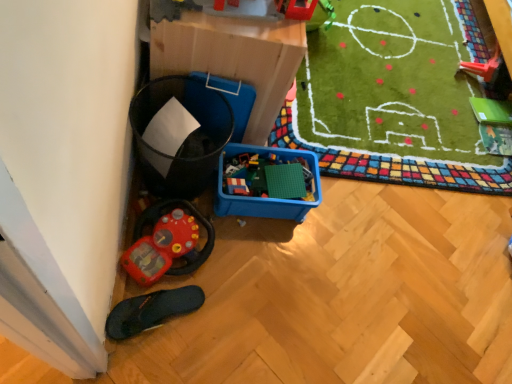
This screenshot has width=512, height=384. I want to click on black rubber slipper at lower left, so click(x=151, y=310).

In order to face rubberized plastic toy at upper center, the second toy from the left, should I rotate leftwards or rightwards?

Turn right approximately 6.769 degrees to face it.

Image resolution: width=512 pixels, height=384 pixels. Identify the location of rubberized plastic toy at upper center, the second toy from the left. (296, 9).

What do you see at coordinates (484, 66) in the screenshot? Image resolution: width=512 pixels, height=384 pixels. I see `rubberized plastic toy at upper right, acting as the third toy starting from the bottom` at bounding box center [484, 66].

Where is `black rubber slipper at lower left`? black rubber slipper at lower left is located at coordinates (151, 310).

Does rubberized red toy car at lower left, which appears as the first toy when ordered from the bottom, appear on the right side of black rubber slipper at lower left?

No, rubberized red toy car at lower left, which appears as the first toy when ordered from the bottom, is not to the right of black rubber slipper at lower left.

Which of these two, rubberized red toy car at lower left, which appears as the first toy when ordered from the bottom, or black rubber slipper at lower left, is thinner?

With smaller width is rubberized red toy car at lower left, which appears as the first toy when ordered from the bottom.

Could you tell me if rubberized red toy car at lower left, the 3th toy when ordered from top to bottom, is facing black rubber slipper at lower left?

No.

The image size is (512, 384). Find the location of `footwear that is below the rubberized red toy car at lower left, arranged as the third toy when viewed from the right (from the image's perspective)`. footwear that is below the rubberized red toy car at lower left, arranged as the third toy when viewed from the right (from the image's perspective) is located at coordinates (151, 310).

From a real-world perspective, does rubberized plastic toy at upper right, the third toy when ordered from front to back, sit lower than rubberized red toy car at lower left, the first toy from the left?

No, from a real-world perspective, rubberized plastic toy at upper right, the third toy when ordered from front to back, is not beneath rubberized red toy car at lower left, the first toy from the left.

Is rubberized plastic toy at upper right, positioned as the third toy in left-to-right order, not close to rubberized red toy car at lower left, which appears as the first toy when ordered from the bottom?

Indeed, rubberized plastic toy at upper right, positioned as the third toy in left-to-right order, is not near rubberized red toy car at lower left, which appears as the first toy when ordered from the bottom.

Is rubberized plastic toy at upper right, the third toy when ordered from front to back, oriented away from rubberized red toy car at lower left, arranged as the third toy when viewed from the right?

rubberized plastic toy at upper right, the third toy when ordered from front to back, is not turned away from rubberized red toy car at lower left, arranged as the third toy when viewed from the right.

In terms of width, does rubberized plastic toy at upper right, the third toy when ordered from front to back, look wider or thinner when compared to rubberized red toy car at lower left, which is counted as the 2th toy, starting from the back?

Considering their sizes, rubberized plastic toy at upper right, the third toy when ordered from front to back, looks slimmer than rubberized red toy car at lower left, which is counted as the 2th toy, starting from the back.

Is black rubber slipper at lower left spatially inside blue plastic storage box at lower left, or outside of it?

black rubber slipper at lower left is located beyond the bounds of blue plastic storage box at lower left.

Is black rubber slipper at lower left positioned with its back to blue plastic storage box at lower left?

No, black rubber slipper at lower left is not facing away from blue plastic storage box at lower left.

From a real-world perspective, is black rubber slipper at lower left beneath blue plastic storage box at lower left?

Yes, from a real-world perspective, black rubber slipper at lower left is beneath blue plastic storage box at lower left.

Considering the relative positions of black rubber slipper at lower left and blue plastic storage box at lower left in the image provided, is black rubber slipper at lower left in front of blue plastic storage box at lower left?

That is False.

Does point (275, 2) appear closer or farther from the camera than point (169, 302)?

Point (275, 2).

Does rubberized plastic toy at upper center, the second toy from the left, have a lesser width compared to black rubber slipper at lower left?

Indeed, rubberized plastic toy at upper center, the second toy from the left, has a lesser width compared to black rubber slipper at lower left.

Who is taller, rubberized plastic toy at upper center, the second toy from the left, or black rubber slipper at lower left?

rubberized plastic toy at upper center, the second toy from the left.

Measure the distance between rubberized plastic toy at upper center, placed as the second toy when sorted from bottom to top, and black rubber slipper at lower left.

1.02 meters.

Based on the photo, how distant is blue plastic storage box at lower left from rubberized plastic toy at upper center, placed as the second toy when sorted from bottom to top?

blue plastic storage box at lower left and rubberized plastic toy at upper center, placed as the second toy when sorted from bottom to top, are 11.36 inches apart.

Is rubberized plastic toy at upper center, which is counted as the second toy, starting from the right, completely or partially inside blue plastic storage box at lower left?

No, rubberized plastic toy at upper center, which is counted as the second toy, starting from the right, is not a part of blue plastic storage box at lower left.

Is point (165, 64) closer or farther from the camera than point (281, 11)?

Point (165, 64) is closer to the camera than point (281, 11).

Is blue plastic storage box at lower left far away from rubberized plastic toy at upper center, placed as the second toy when sorted from bottom to top?

blue plastic storage box at lower left is near rubberized plastic toy at upper center, placed as the second toy when sorted from bottom to top, not far away.

Are blue plastic storage box at lower left and rubberized plastic toy at upper right, acting as the third toy starting from the bottom, far apart?

Yes, blue plastic storage box at lower left and rubberized plastic toy at upper right, acting as the third toy starting from the bottom, are located far from each other.

Considering the positions of objects blue plastic storage box at lower left and rubberized plastic toy at upper right, the 1th toy positioned from the right, in the image provided, who is behind, blue plastic storage box at lower left or rubberized plastic toy at upper right, the 1th toy positioned from the right,?

rubberized plastic toy at upper right, the 1th toy positioned from the right, is more distant.

Looking at this image, could you tell me if blue plastic storage box at lower left is turned towards rubberized plastic toy at upper right, positioned as the third toy in left-to-right order?

Yes, blue plastic storage box at lower left is oriented towards rubberized plastic toy at upper right, positioned as the third toy in left-to-right order.

Is rubberized plastic toy at upper right, acting as the third toy starting from the bottom, further to camera compared to blue plastic storage box at lower left?

Yes, rubberized plastic toy at upper right, acting as the third toy starting from the bottom, is further from the viewer.

Measure the distance from rubberized plastic toy at upper right, positioned as the third toy in left-to-right order, to blue plastic storage box at lower left.

rubberized plastic toy at upper right, positioned as the third toy in left-to-right order, is 4.53 feet from blue plastic storage box at lower left.

In the scene shown: Considering the sizes of objects rubberized plastic toy at upper right, arranged as the 1th toy when viewed from the back, and blue plastic storage box at lower left in the image provided, who is taller, rubberized plastic toy at upper right, arranged as the 1th toy when viewed from the back, or blue plastic storage box at lower left?

blue plastic storage box at lower left.

Is rubberized plastic toy at upper right, positioned as the third toy in left-to-right order, facing away from blue plastic storage box at lower left?

No, rubberized plastic toy at upper right, positioned as the third toy in left-to-right order, is not facing away from blue plastic storage box at lower left.

What are the coordinates of `footwear below the rubberized red toy car at lower left, the 3th toy when ordered from top to bottom (from the image's perspective)` in the screenshot? It's located at (151, 310).

You are a GUI agent. You are given a task and a screenshot of the screen. Output one action in this format:
    pyautogui.click(x=<x>, y=<y>)
    Task: Click on the 1st toy in front of the rubberized plastic toy at upper right, arranged as the 1th toy when viewed from the back
    
    Given the screenshot: What is the action you would take?
    pyautogui.click(x=167, y=241)

Which object lies further to the anchor point rubberized plastic toy at upper center, which is the 2th toy in top-to-bottom order, black rubber slipper at lower left or rubberized red toy car at lower left, arranged as the third toy when viewed from the right?

black rubber slipper at lower left is positioned further to the anchor rubberized plastic toy at upper center, which is the 2th toy in top-to-bottom order.

In the scene shown: Based on their spatial positions, is blue plastic storage box at lower left or rubberized red toy car at lower left, the first toy from the left, further from black rubber slipper at lower left?

Based on the image, blue plastic storage box at lower left appears to be further to black rubber slipper at lower left.

From the image, which object appears to be nearer to blue plastic storage box at lower left, rubberized red toy car at lower left, which is counted as the 2th toy, starting from the back, or black rubber slipper at lower left?

The object closer to blue plastic storage box at lower left is rubberized red toy car at lower left, which is counted as the 2th toy, starting from the back.

Considering their positions, is rubberized plastic toy at upper right, acting as the third toy starting from the bottom, positioned closer to rubberized red toy car at lower left, the first toy from the left, than rubberized plastic toy at upper center, placed as the second toy when sorted from bottom to top?

rubberized plastic toy at upper center, placed as the second toy when sorted from bottom to top, is positioned closer to the anchor rubberized red toy car at lower left, the first toy from the left.

Estimate the real-world distances between objects in this image. Which object is further from blue plastic storage box at lower left, black rubber slipper at lower left or rubberized red toy car at lower left, which appears as the first toy when ordered from the bottom?

black rubber slipper at lower left lies further to blue plastic storage box at lower left than the other object.

When comparing their distances from rubberized red toy car at lower left, the first toy from the left, does blue plastic storage box at lower left or rubberized plastic toy at upper center, the second toy from the left, seem further?

Based on the image, rubberized plastic toy at upper center, the second toy from the left, appears to be further to rubberized red toy car at lower left, the first toy from the left.

Considering their positions, is black rubber slipper at lower left positioned further to rubberized red toy car at lower left, the first toy from the left, than rubberized plastic toy at upper right, acting as the 1th toy starting from the top?

rubberized plastic toy at upper right, acting as the 1th toy starting from the top, is positioned further to the anchor rubberized red toy car at lower left, the first toy from the left.

Looking at the image, which one is located closer to blue plastic storage box at lower left, black rubber slipper at lower left or rubberized plastic toy at upper right, the 1th toy positioned from the right?

black rubber slipper at lower left lies closer to blue plastic storage box at lower left than the other object.

Where is `toy situated between blue plastic storage box at lower left and rubberized plastic toy at upper right, the 1th toy positioned from the right, from left to right`? This screenshot has width=512, height=384. toy situated between blue plastic storage box at lower left and rubberized plastic toy at upper right, the 1th toy positioned from the right, from left to right is located at coordinates (296, 9).

The image size is (512, 384). I want to click on footwear between rubberized red toy car at lower left, which appears as the first toy when ordered from the bottom, and rubberized plastic toy at upper right, acting as the 1th toy starting from the top, so click(x=151, y=310).

Find the location of a particular element. This screenshot has width=512, height=384. toy between rubberized red toy car at lower left, which appears as the first toy when ordered from the bottom, and rubberized plastic toy at upper right, acting as the 1th toy starting from the top, from left to right is located at coordinates (296, 9).

What are the coordinates of `storage box between rubberized red toy car at lower left, arranged as the third toy when viewed from the right, and rubberized plastic toy at upper right, acting as the third toy starting from the bottom` in the screenshot? It's located at (232, 56).